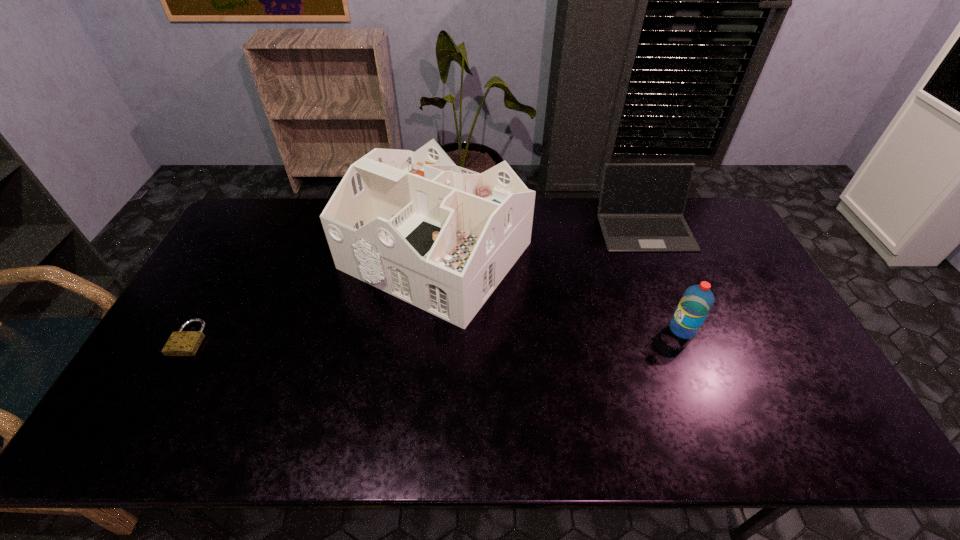
In the image, there is a desktop. Where is `free space at the far left corner`? This screenshot has height=540, width=960. free space at the far left corner is located at coordinates (260, 234).

Image resolution: width=960 pixels, height=540 pixels. Identify the location of vacant space at the far right corner. (698, 235).

Where is `free spot between the dollhouse and the leftmost object`? free spot between the dollhouse and the leftmost object is located at coordinates (312, 297).

Where is `free point between the water bottle and the tallest object`? The height and width of the screenshot is (540, 960). free point between the water bottle and the tallest object is located at coordinates (559, 293).

Locate an element on the screen. The image size is (960, 540). vacant region between the water bottle and the laptop is located at coordinates (663, 279).

The image size is (960, 540). Find the location of `unoccupied position between the third object from right to left and the padlock`. unoccupied position between the third object from right to left and the padlock is located at coordinates (312, 297).

Where is `free area in between the third object from right to left and the laptop`? This screenshot has height=540, width=960. free area in between the third object from right to left and the laptop is located at coordinates (540, 242).

Identify the location of vacant space that's between the laptop and the dollhouse. [540, 242].

Find the location of a particular element. vacant space in between the water bottle and the laptop is located at coordinates (663, 279).

Find the location of a particular element. This screenshot has height=540, width=960. vacant space in between the water bottle and the dollhouse is located at coordinates (559, 293).